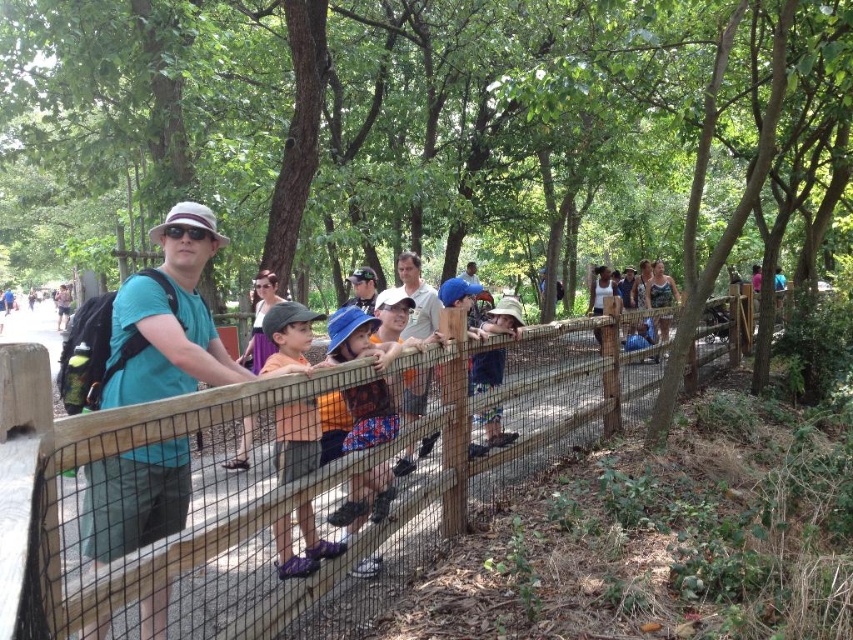
Is point (605, 321) positioned in front of point (229, 461)?

No, it is behind (229, 461).

Does wooden fence at center have a larger size compared to purple satin dress at center?

Incorrect, wooden fence at center is not larger than purple satin dress at center.

The width and height of the screenshot is (853, 640). What are the coordinates of `wooden fence at center` in the screenshot? It's located at (277, 484).

Identify the location of orange fabric shirt at center. (296, 440).

Can you confirm if orange fabric shirt at center is positioned below purple satin dress at center?

Correct, orange fabric shirt at center is located below purple satin dress at center.

The image size is (853, 640). What do you see at coordinates (296, 440) in the screenshot? I see `orange fabric shirt at center` at bounding box center [296, 440].

Locate an element on the screen. The image size is (853, 640). orange fabric shirt at center is located at coordinates (296, 440).

Is wooden fence at center to the left of blue denim shorts at center from the viewer's perspective?

Indeed, wooden fence at center is positioned on the left side of blue denim shorts at center.

Between wooden fence at center and blue denim shorts at center, which one has more height?

With more height is blue denim shorts at center.

Who is more distant from viewer, (x=459, y=417) or (x=490, y=312)?

Positioned behind is point (x=490, y=312).

Find the location of a particular element. Image resolution: width=853 pixels, height=640 pixels. wooden fence at center is located at coordinates (277, 484).